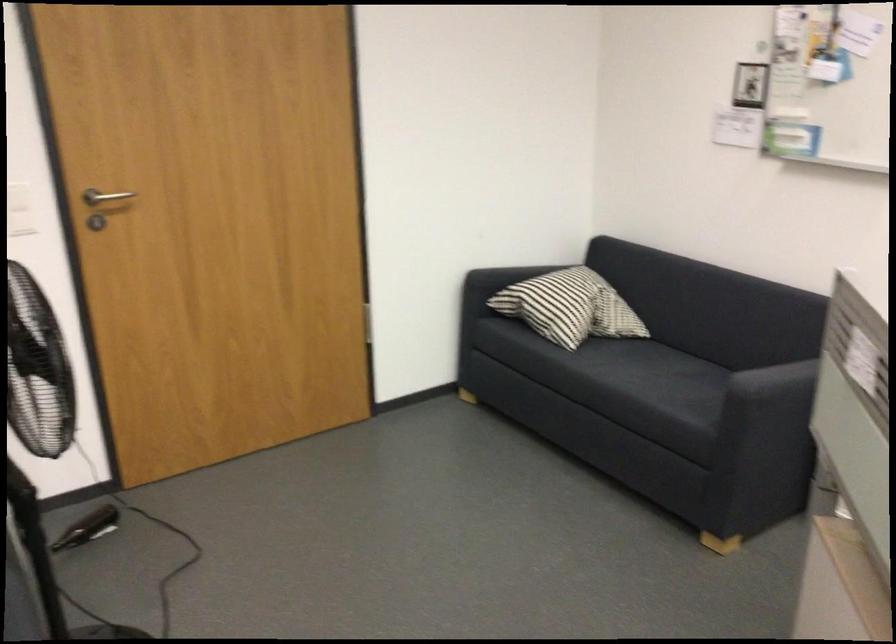
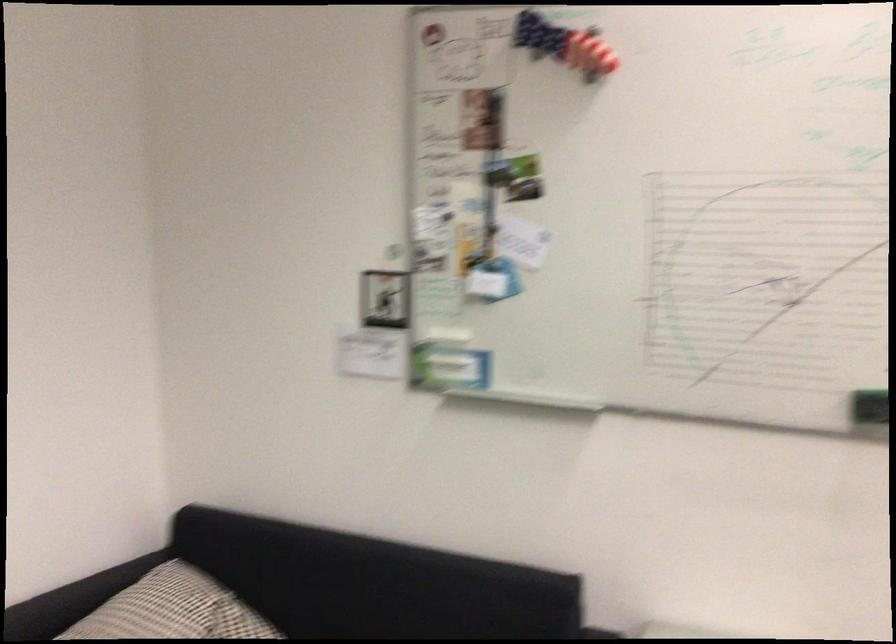
Locate, in the second image, the point that corresponds to the point at 586,286 in the first image.

(193, 612)